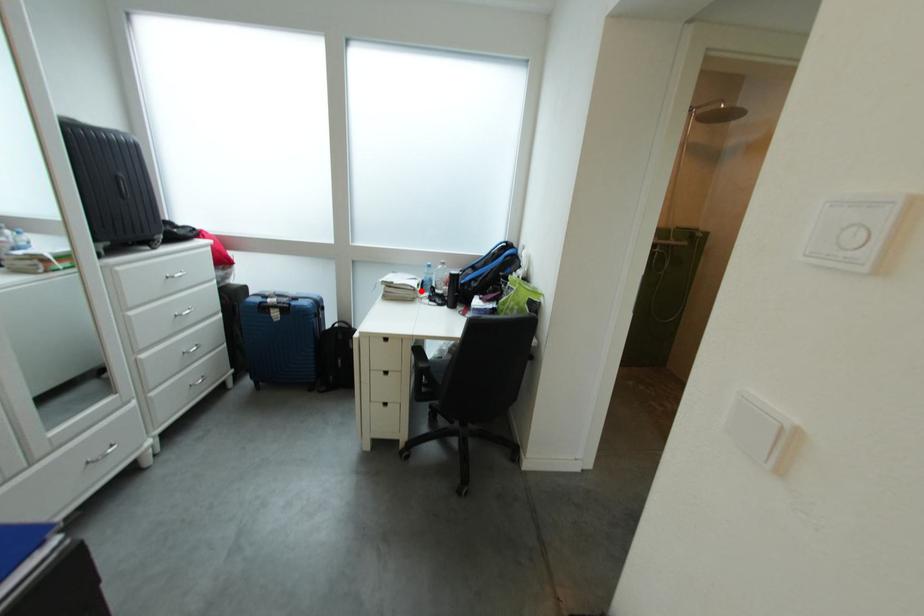
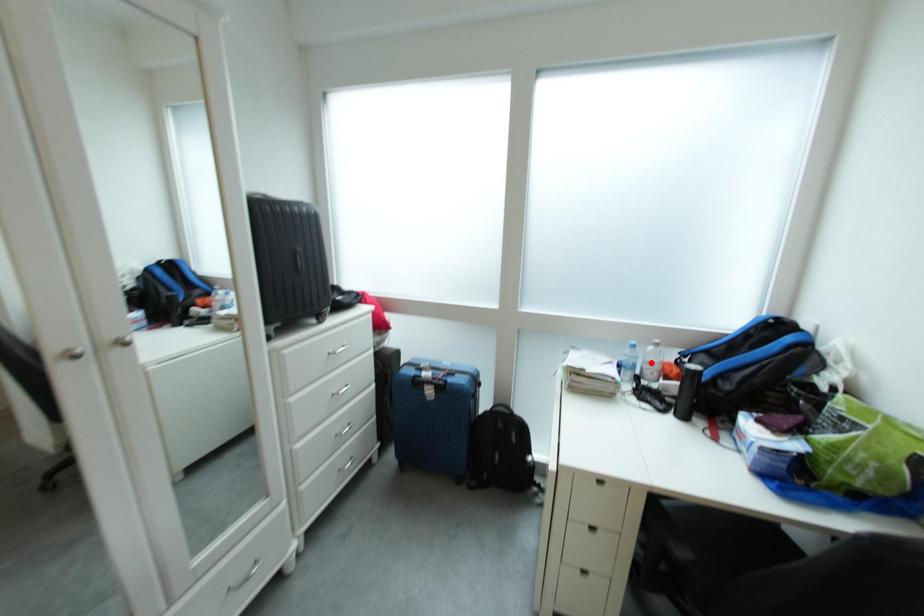
I am providing you with two images of the same scene from different viewpoints. A red point is marked on the first image and another point is marked on the second image. Are the points marked in image1 and image2 representing the same 3D position?

No